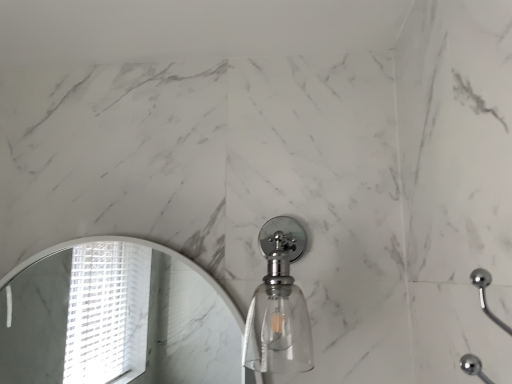
Question: Should I look upward or downward to see white marble mirror at upper left?

Choices:
 (A) down
 (B) up

Answer: (A)

Question: Is white marble mirror at upper left positioned in front of clear glass soap dispenser at center?

Choices:
 (A) no
 (B) yes

Answer: (A)

Question: Does white marble mirror at upper left have a larger size compared to clear glass soap dispenser at center?

Choices:
 (A) yes
 (B) no

Answer: (B)

Question: Is white marble mirror at upper left facing away from clear glass soap dispenser at center?

Choices:
 (A) no
 (B) yes

Answer: (A)

Question: Is white marble mirror at upper left not inside clear glass soap dispenser at center?

Choices:
 (A) no
 (B) yes

Answer: (B)

Question: Can you confirm if white marble mirror at upper left is thinner than clear glass soap dispenser at center?

Choices:
 (A) yes
 (B) no

Answer: (A)

Question: From a real-world perspective, is white marble mirror at upper left over clear glass soap dispenser at center?

Choices:
 (A) no
 (B) yes

Answer: (A)

Question: From a real-world perspective, is clear glass soap dispenser at center beneath white marble mirror at upper left?

Choices:
 (A) no
 (B) yes

Answer: (A)

Question: Would you say clear glass soap dispenser at center is a long distance from white marble mirror at upper left?

Choices:
 (A) no
 (B) yes

Answer: (B)

Question: Is clear glass soap dispenser at center thinner than white marble mirror at upper left?

Choices:
 (A) yes
 (B) no

Answer: (B)

Question: Is clear glass soap dispenser at center beside white marble mirror at upper left?

Choices:
 (A) no
 (B) yes

Answer: (A)

Question: Does clear glass soap dispenser at center have a smaller size compared to white marble mirror at upper left?

Choices:
 (A) yes
 (B) no

Answer: (B)

Question: Is clear glass soap dispenser at center bigger than white marble mirror at upper left?

Choices:
 (A) yes
 (B) no

Answer: (A)

Question: From a real-world perspective, is clear glass soap dispenser at center above or below white marble mirror at upper left?

Choices:
 (A) above
 (B) below

Answer: (A)